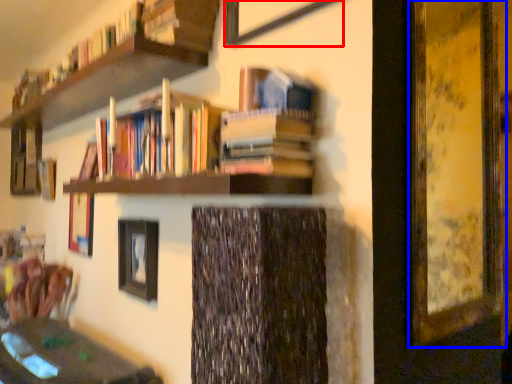
Question: Which point is closer to the camera, picture frame (highlighted by a red box) or picture frame (highlighted by a blue box)?

Choices:
 (A) picture frame
 (B) picture frame

Answer: (A)